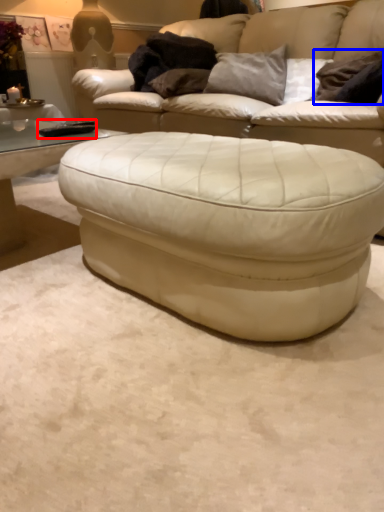
Question: Which object appears closest to the camera in this image, pad (highlighted by a red box) or pillow (highlighted by a blue box)?

Choices:
 (A) pad
 (B) pillow

Answer: (A)